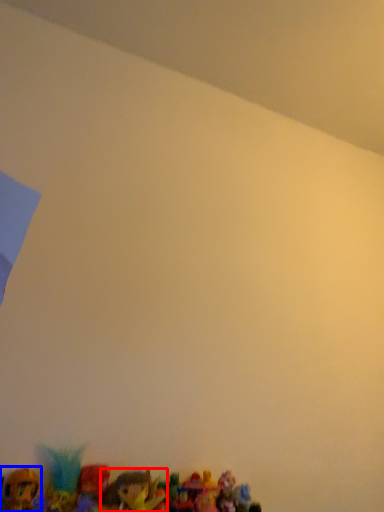
Question: Which object is closer to the camera taking this photo, toy (highlighted by a red box) or toy (highlighted by a blue box)?

Choices:
 (A) toy
 (B) toy

Answer: (A)